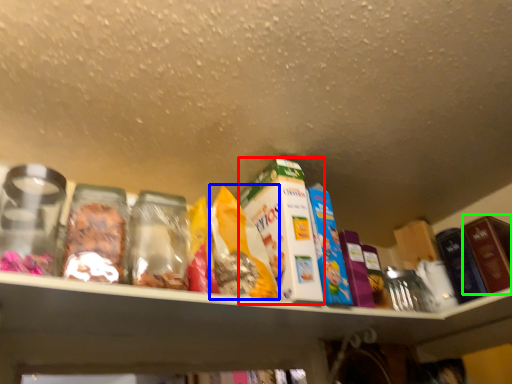
Question: Estimate the real-world distances between objects in this image. Which object is farther from product (highlighted by a red box), cereal (highlighted by a blue box) or product (highlighted by a green box)?

Choices:
 (A) cereal
 (B) product

Answer: (B)